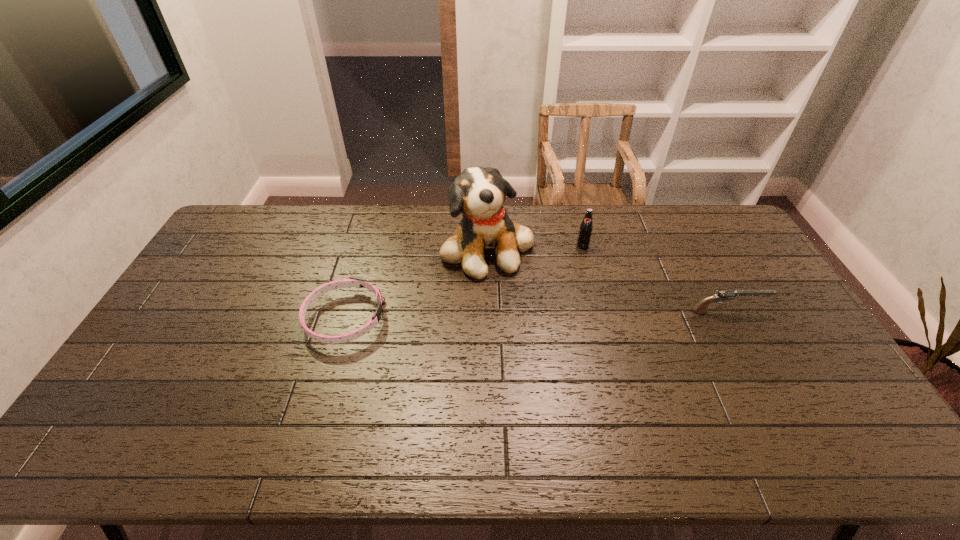
Locate an element on the screen. free spot between the gun and the pop is located at coordinates (655, 279).

Identify the location of free area in between the shortest object and the rightmost object. (537, 315).

At what (x,y) coordinates should I click in order to perform the action: click on free point between the second tallest object and the tallest object. Please return your answer as a coordinate pair (x, y). The width and height of the screenshot is (960, 540). Looking at the image, I should click on (535, 246).

Identify which object is the nearest to the shortest object. Please provide its 2D coordinates. Your answer should be formatted as a tuple, i.e. [(x, y)], where the tuple contains the x and y coordinates of a point satisfying the conditions above.

[(478, 193)]

The height and width of the screenshot is (540, 960). In order to click on object that is the closest one to the shortest object in this screenshot , I will do `click(478, 193)`.

The height and width of the screenshot is (540, 960). What are the coordinates of `free space that satisfies the following two spatial constraints: 1. on the front side of the gun; 2. aiming along the barrel of the second tallest object` in the screenshot? It's located at (x=599, y=311).